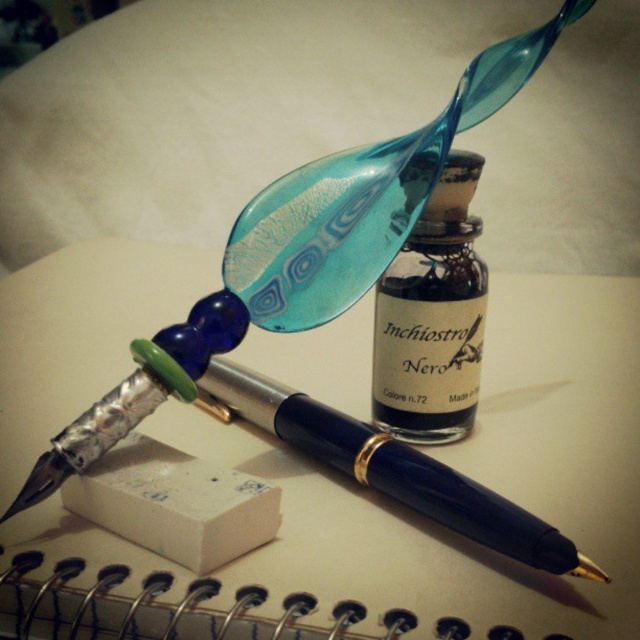
In the scene shown: You are looking at the arrangement of writing tools on the desk. There are two points marked as point 1 and point 2. Point 1 is located at coordinates (538,397) and point 2 is at (429,241). Which point is closer to you?

Point 1 at coordinates (538,397) is closer to you because it is further to the camera than point 2 at (429,241).